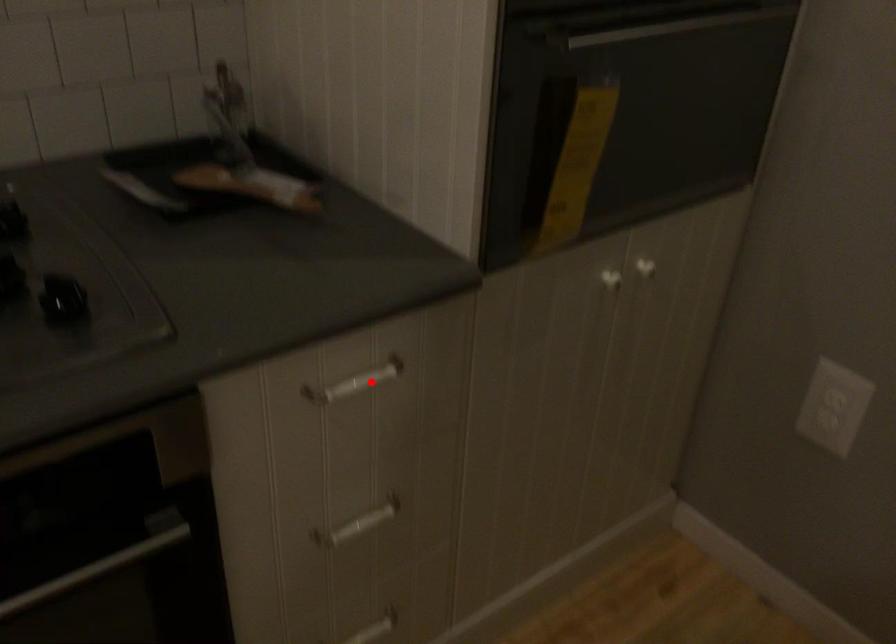
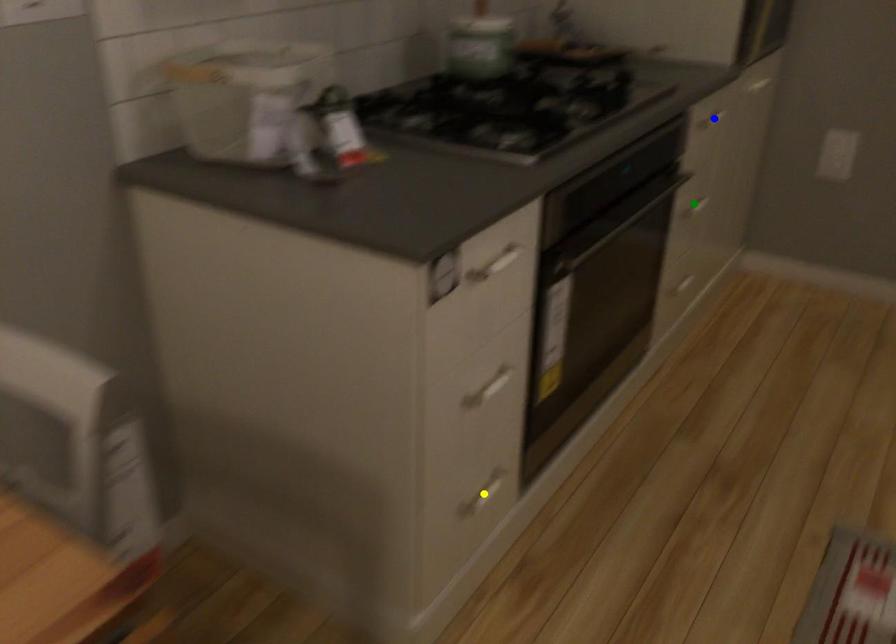
Question: I am providing you with two images of the same scene from different viewpoints. A red point is marked on the first image. You are given multiple points on the second image. Which point in image 2 represents the same 3d spot as the red point in image 1?

Choices:
 (A) yellow point
 (B) blue point
 (C) green point

Answer: (B)